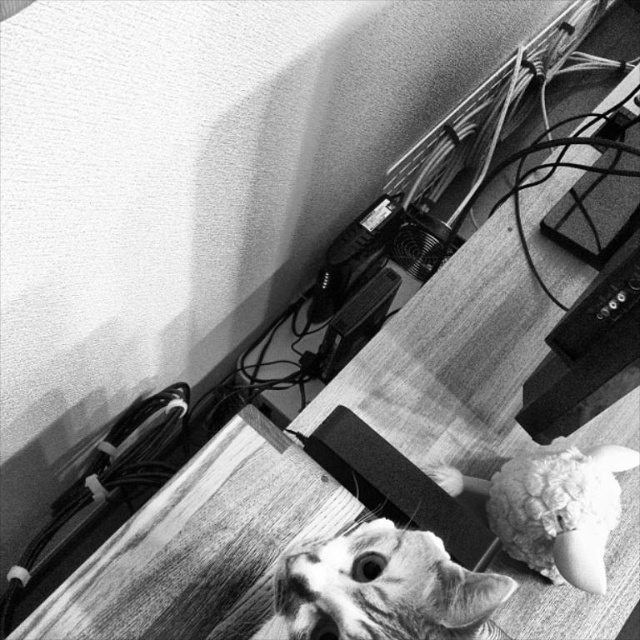
Question: Among these objects, which one is farthest from the camera?

Choices:
 (A) fluffy fabric doll at lower right
 (B) tabby fur cat at center

Answer: (A)

Question: Does tabby fur cat at center appear under fluffy fabric doll at lower right?

Choices:
 (A) yes
 (B) no

Answer: (A)

Question: Which point is farther from the camera taking this photo?

Choices:
 (A) (563, 554)
 (B) (314, 627)

Answer: (A)

Question: Can you confirm if tabby fur cat at center is thinner than fluffy fabric doll at lower right?

Choices:
 (A) yes
 (B) no

Answer: (A)

Question: Which point appears closest to the camera in this image?

Choices:
 (A) (406, 572)
 (B) (566, 544)

Answer: (A)

Question: Can you confirm if tabby fur cat at center is positioned above fluffy fabric doll at lower right?

Choices:
 (A) no
 (B) yes

Answer: (A)